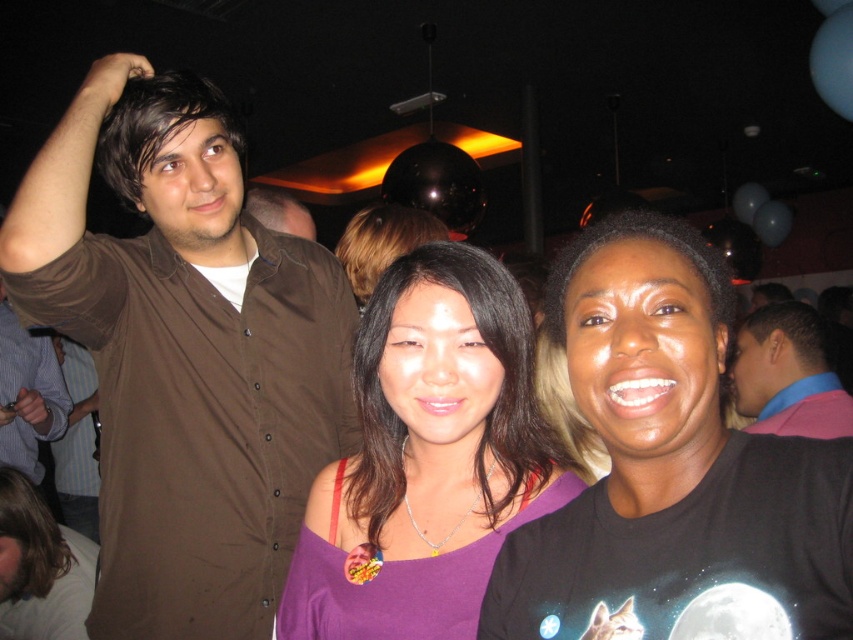
Question: Which object appears closest to the camera in this image?

Choices:
 (A) black matte t-shirt at center
 (B) pink fabric shirt at right

Answer: (A)

Question: Does brown shirt at left lie behind dark brown hair at center?

Choices:
 (A) no
 (B) yes

Answer: (B)

Question: Which point is farther to the camera?

Choices:
 (A) (247, 208)
 (B) (631, 481)
 (C) (399, 387)
 (D) (35, 611)

Answer: (A)

Question: Can you confirm if purple satin top at center is positioned above dark brown hair at center?

Choices:
 (A) no
 (B) yes

Answer: (A)

Question: Does black matte t-shirt at center appear on the left side of pink fabric shirt at right?

Choices:
 (A) yes
 (B) no

Answer: (A)

Question: Which of the following is the closest to the observer?

Choices:
 (A) (15, 604)
 (B) (67, 396)

Answer: (A)